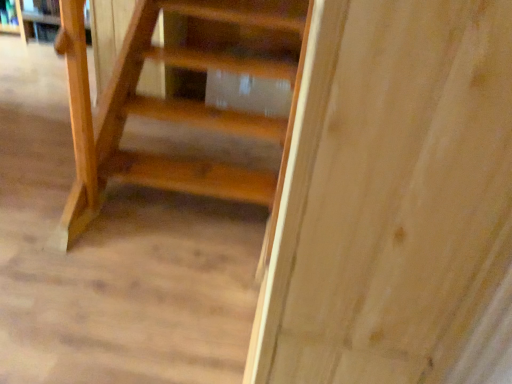
Question: Is wooden shelf at upper left wider than matte wooden book at upper left?

Choices:
 (A) yes
 (B) no

Answer: (A)

Question: From the image's perspective, does wooden shelf at upper left appear higher than matte wooden book at upper left?

Choices:
 (A) yes
 (B) no

Answer: (A)

Question: Is wooden shelf at upper left behind matte wooden book at upper left?

Choices:
 (A) yes
 (B) no

Answer: (B)

Question: Is wooden shelf at upper left facing towards matte wooden book at upper left?

Choices:
 (A) yes
 (B) no

Answer: (A)

Question: From a real-world perspective, is wooden shelf at upper left on matte wooden book at upper left?

Choices:
 (A) yes
 (B) no

Answer: (B)

Question: Considering the relative sizes of wooden shelf at upper left and matte wooden book at upper left in the image provided, is wooden shelf at upper left smaller than matte wooden book at upper left?

Choices:
 (A) yes
 (B) no

Answer: (B)

Question: Is wooden shelf at upper left located within matte wooden book at upper left?

Choices:
 (A) no
 (B) yes

Answer: (A)

Question: Does matte wooden book at upper left have a larger size compared to wooden shelf at upper left?

Choices:
 (A) yes
 (B) no

Answer: (B)

Question: Can you confirm if matte wooden book at upper left is positioned to the right of wooden shelf at upper left?

Choices:
 (A) yes
 (B) no

Answer: (B)

Question: Is matte wooden book at upper left not inside wooden shelf at upper left?

Choices:
 (A) no
 (B) yes

Answer: (A)

Question: Can you confirm if matte wooden book at upper left is shorter than wooden shelf at upper left?

Choices:
 (A) no
 (B) yes

Answer: (B)

Question: From the image's perspective, does matte wooden book at upper left appear lower than wooden shelf at upper left?

Choices:
 (A) no
 (B) yes

Answer: (B)

Question: Is matte wooden book at upper left taller or shorter than wooden shelf at upper left?

Choices:
 (A) short
 (B) tall

Answer: (A)